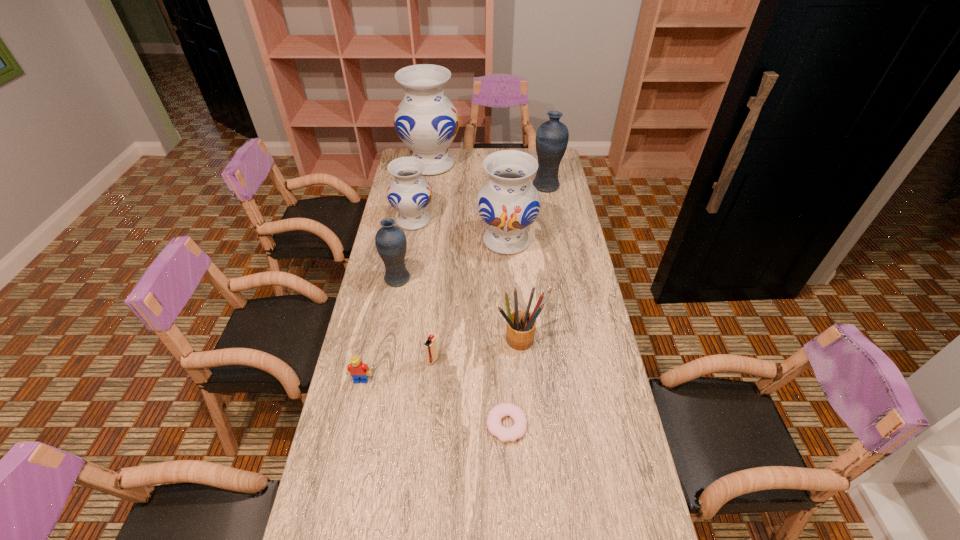
What are the coordinates of `the fourth nearest object` in the screenshot? It's located at (520, 330).

Locate an element on the screen. red igniter is located at coordinates (430, 345).

Where is `igniter`? igniter is located at coordinates (430, 345).

I want to click on Lego, so click(358, 370).

Identify the location of the eighth farthest object. (358, 370).

The image size is (960, 540). What are the coordinates of `doughnut` in the screenshot? It's located at (517, 430).

Where is `the nearest object`? the nearest object is located at coordinates coord(517,430).

Locate an element on the screen. The width and height of the screenshot is (960, 540). vacant area situated 0.280m on the front of the tallest vase is located at coordinates (423, 216).

Image resolution: width=960 pixels, height=540 pixels. I want to click on vacant area situated 0.130m on the left of the rightmost vase, so click(504, 186).

At what (x,y) coordinates should I click in order to perform the action: click on free space located 0.390m on the front of the rightmost red vase. Please return your answer as a coordinate pair (x, y). This screenshot has width=960, height=540. Looking at the image, I should click on (514, 341).